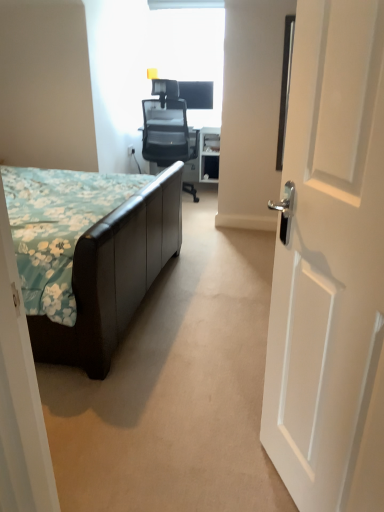
Image resolution: width=384 pixels, height=512 pixels. I want to click on black mesh office chair at center, so click(170, 121).

How different are the orientations of white wooden door at right and brown leather bed at left in degrees?

They differ by 154 degrees in their facing directions.

Is brown leather bed at left located within white wooden door at right?

Actually, brown leather bed at left is outside white wooden door at right.

From a real-world perspective, does white wooden door at right stand above brown leather bed at left?

Indeed, from a real-world perspective, white wooden door at right stands above brown leather bed at left.

Between white wooden door at right and brown leather bed at left, which one appears on the left side from the viewer's perspective?

brown leather bed at left is more to the left.

Is white wooden door at right beside black mesh office chair at center?

No, white wooden door at right is not in contact with black mesh office chair at center.

Between white wooden door at right and black mesh office chair at center, which one is positioned in front?

white wooden door at right is more forward.

Is white wooden door at right taller or shorter than black mesh office chair at center?

In the image, white wooden door at right appears to be taller than black mesh office chair at center.

Is white wooden door at right wider or thinner than black mesh office chair at center?

Clearly, white wooden door at right has less width compared to black mesh office chair at center.

Looking at their sizes, would you say black mesh office chair at center is wider or thinner than brown leather bed at left?

black mesh office chair at center is thinner than brown leather bed at left.

Considering the relative positions of black mesh office chair at center and brown leather bed at left in the image provided, is black mesh office chair at center to the right of brown leather bed at left from the viewer's perspective?

Yes, black mesh office chair at center is to the right of brown leather bed at left.

Is black mesh office chair at center facing away from brown leather bed at left?

That's right, black mesh office chair at center is facing away from brown leather bed at left.

Does black mesh office chair at center have a lesser height compared to brown leather bed at left?

No.

Is black mesh office chair at center next to white wooden door at right and touching it?

black mesh office chair at center and white wooden door at right are not in contact.

Is black mesh office chair at center to the right of white wooden door at right from the viewer's perspective?

In fact, black mesh office chair at center is to the left of white wooden door at right.

Who is bigger, black mesh office chair at center or white wooden door at right?

black mesh office chair at center.

How distant is brown leather bed at left from white wooden door at right?

brown leather bed at left and white wooden door at right are 96.44 centimeters apart.

Between brown leather bed at left and white wooden door at right, which one has less height?

Standing shorter between the two is brown leather bed at left.

Between brown leather bed at left and white wooden door at right, which one appears on the left side from the viewer's perspective?

brown leather bed at left is more to the left.

Does point (80, 265) come closer to viewer compared to point (358, 230)?

That is False.

Find the location of `chair on the right of the brown leather bed at left`. chair on the right of the brown leather bed at left is located at coordinates (170, 121).

Looking at this image, which object is more forward, brown leather bed at left or black mesh office chair at center?

brown leather bed at left is more forward.

From a real-world perspective, is brown leather bed at left on top of black mesh office chair at center?

No, from a real-world perspective, brown leather bed at left is not on top of black mesh office chair at center.

Based on the photo, between brown leather bed at left and black mesh office chair at center, which one has smaller size?

With smaller size is black mesh office chair at center.

Where is `bed located behind the white wooden door at right`? The height and width of the screenshot is (512, 384). bed located behind the white wooden door at right is located at coordinates (105, 275).

Where is `door above the black mesh office chair at center (from a real-world perspective)`? The height and width of the screenshot is (512, 384). door above the black mesh office chair at center (from a real-world perspective) is located at coordinates (330, 266).

Considering their positions, is black mesh office chair at center positioned closer to white wooden door at right than brown leather bed at left?

The object closer to white wooden door at right is brown leather bed at left.

Based on their spatial positions, is brown leather bed at left or black mesh office chair at center further from white wooden door at right?

Among the two, black mesh office chair at center is located further to white wooden door at right.

Based on their spatial positions, is black mesh office chair at center or white wooden door at right further from brown leather bed at left?

black mesh office chair at center is further to brown leather bed at left.

Based on their spatial positions, is white wooden door at right or brown leather bed at left further from black mesh office chair at center?

white wooden door at right is further to black mesh office chair at center.

When comparing their distances from black mesh office chair at center, does brown leather bed at left or white wooden door at right seem closer?

brown leather bed at left is positioned closer to the anchor black mesh office chair at center.

When comparing their distances from brown leather bed at left, does white wooden door at right or black mesh office chair at center seem further?

Among the two, black mesh office chair at center is located further to brown leather bed at left.

Where is `bed located between white wooden door at right and black mesh office chair at center in the depth direction`? The image size is (384, 512). bed located between white wooden door at right and black mesh office chair at center in the depth direction is located at coordinates (105, 275).